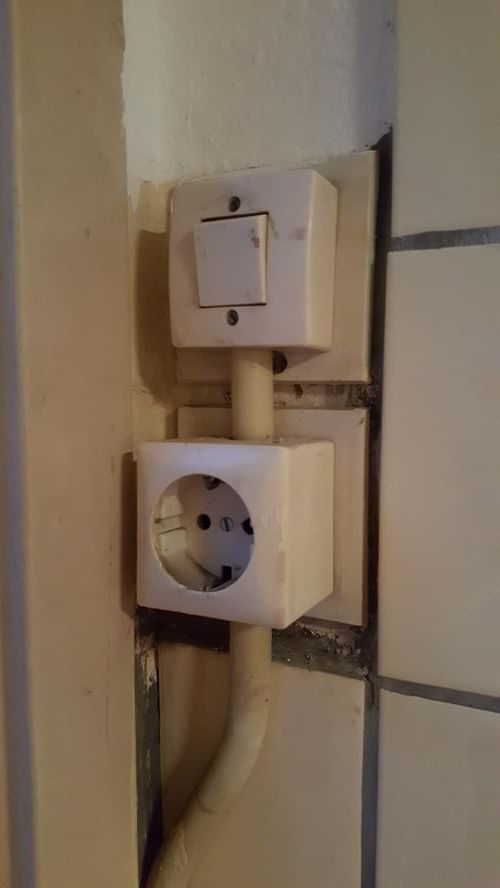
Where is `tile`? tile is located at coordinates (407, 541).